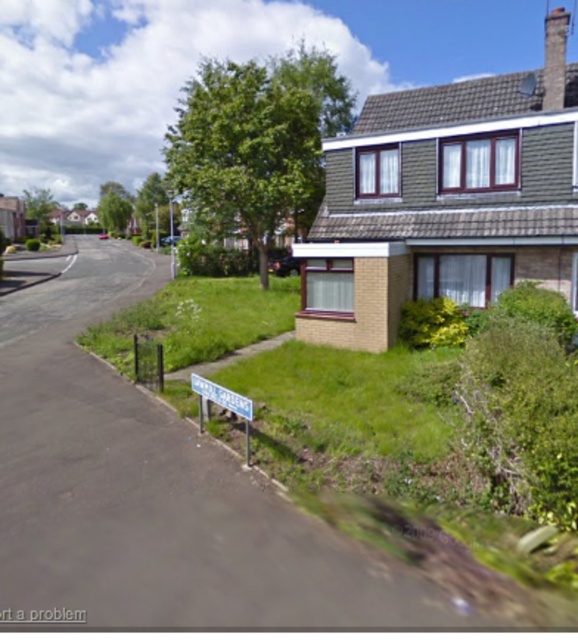
Between point (243, 403) and point (209, 397), which one is positioned behind?

Point (209, 397)

Is blue plastic street sign at lower center above white plastic street sign at lower center?

No, blue plastic street sign at lower center is not above white plastic street sign at lower center.

Is point (247, 422) positioned before point (198, 390)?

Yes, point (247, 422) is in front of point (198, 390).

The width and height of the screenshot is (578, 640). In order to click on blue plastic street sign at lower center in this screenshot , I will do `click(224, 404)`.